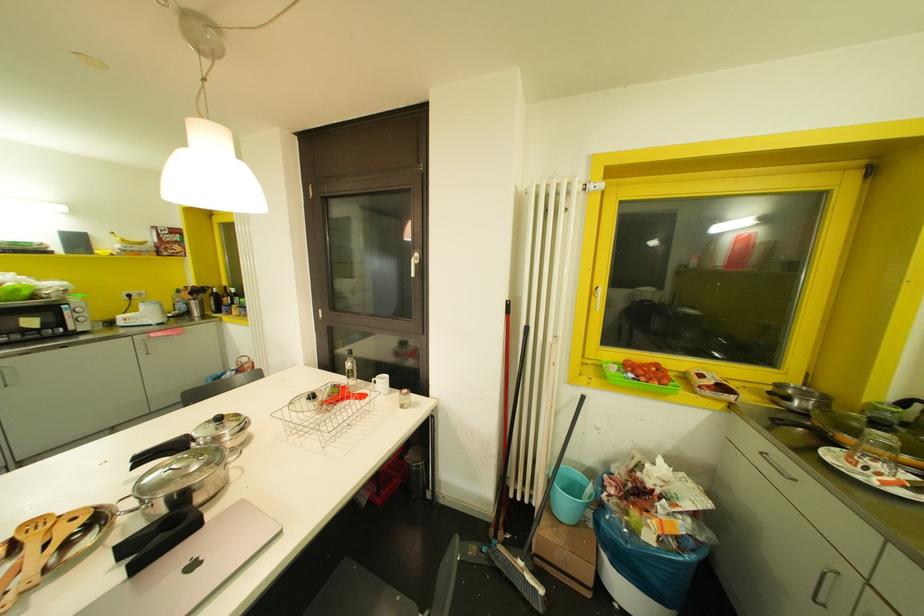
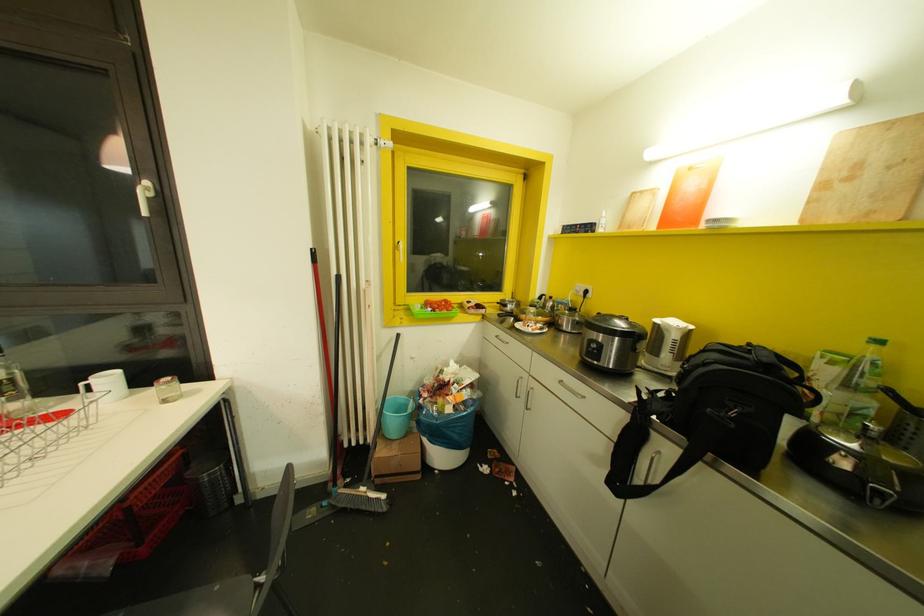
Question: The camera is either moving clockwise (left) or counter-clockwise (right) around the object. The first image is from the beginning of the video and the second image is from the end. Is the camera moving left or right when shooting the video?

Choices:
 (A) Left
 (B) Right

Answer: (A)